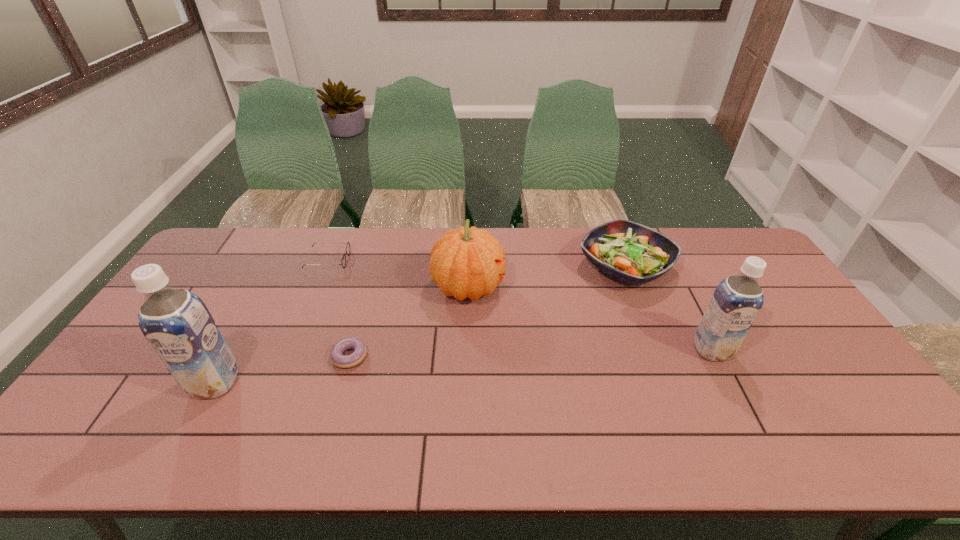
You are a GUI agent. You are given a task and a screenshot of the screen. Output one action in this format:
    pyautogui.click(x=<x>, y=<y>)
    Task: Click on the left soya milk
    This screenshot has height=540, width=960.
    Given the screenshot: What is the action you would take?
    pyautogui.click(x=176, y=323)

This screenshot has height=540, width=960. In order to click on the taller soya milk in this screenshot , I will do `click(176, 323)`.

Locate an element on the screen. This screenshot has height=540, width=960. the shorter soya milk is located at coordinates (737, 300).

This screenshot has height=540, width=960. I want to click on the fifth shortest object, so click(737, 300).

Find the location of a particular element. sunglasses is located at coordinates (343, 261).

Identify the location of the second object from left to right. (343, 261).

In order to click on salad plate in this screenshot , I will do `click(630, 252)`.

In order to click on the fourth object from right to left in this screenshot , I will do `click(336, 355)`.

I want to click on the shortest object, so click(x=336, y=355).

The height and width of the screenshot is (540, 960). I want to click on pumpkin, so click(465, 262).